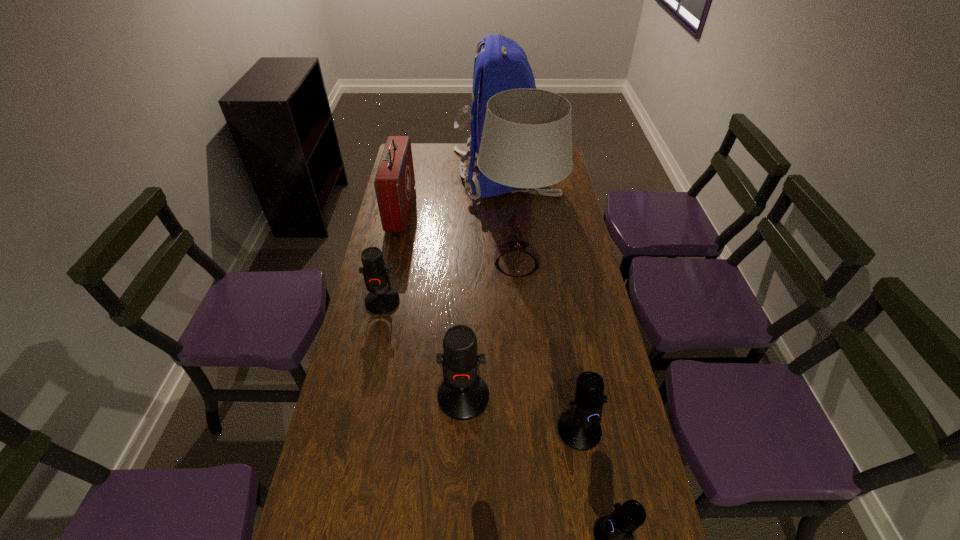
Image resolution: width=960 pixels, height=540 pixels. Find the location of `microphone that is at the left edge`. microphone that is at the left edge is located at coordinates (381, 299).

Where is `backpack positioned at the right edge`? backpack positioned at the right edge is located at coordinates (502, 65).

Where is `table lamp at the right edge`? The height and width of the screenshot is (540, 960). table lamp at the right edge is located at coordinates (526, 143).

Where is `microphone that is at the right edge`? The height and width of the screenshot is (540, 960). microphone that is at the right edge is located at coordinates (579, 428).

This screenshot has width=960, height=540. Identify the location of object at the far right corner. (502, 65).

Locate an element on the screen. vacant point at the far edge is located at coordinates (435, 154).

Where is `vacant area at the left edge`? The width and height of the screenshot is (960, 540). vacant area at the left edge is located at coordinates (422, 174).

In order to click on vacant space at the right edge of the desktop in this screenshot , I will do `click(589, 338)`.

The image size is (960, 540). Identify the location of free space at the far left corner. [x=422, y=151].

Identify the location of unoccupied area between the farther red microphone and the blue backpack. The width and height of the screenshot is (960, 540). 444,238.